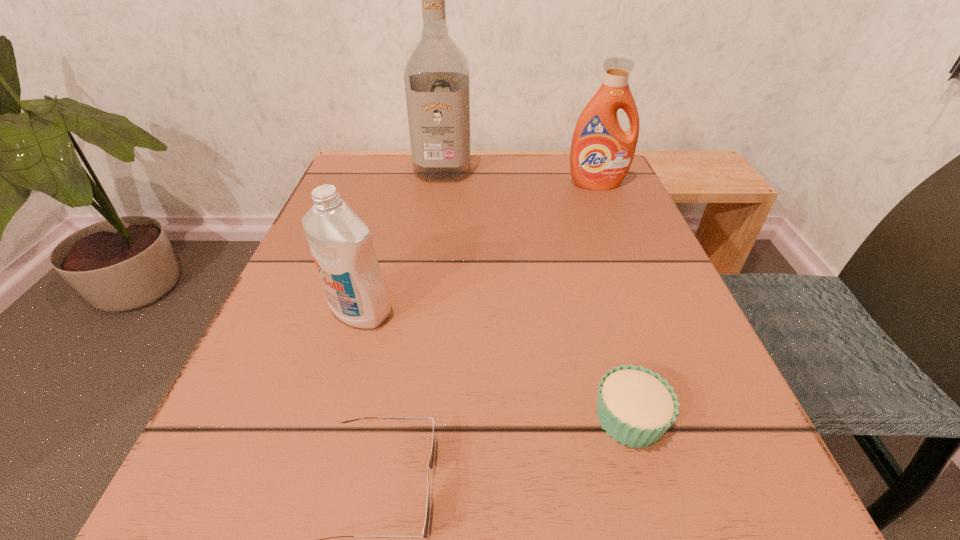
I want to click on unoccupied position between the right detergent and the left detergent, so click(478, 248).

Where is `free space between the second shortest object and the liquor`? The height and width of the screenshot is (540, 960). free space between the second shortest object and the liquor is located at coordinates (537, 294).

Locate an element on the screen. The height and width of the screenshot is (540, 960). blank region between the second shortest object and the tallest object is located at coordinates (537, 294).

This screenshot has width=960, height=540. What are the coordinates of `vacant space in between the second shortest object and the right detergent` in the screenshot? It's located at (613, 301).

Identify the location of unoccupied area between the cupcake and the farther detergent. (613, 301).

Identify the location of vacant space that's between the cupcake and the liquor. click(537, 294).

Locate an element on the screen. This screenshot has height=540, width=960. blank region between the liquor and the taller detergent is located at coordinates coord(519,177).

The height and width of the screenshot is (540, 960). In order to click on object that can be found as the closest to the shorter detergent in this screenshot , I will do `click(432, 457)`.

The width and height of the screenshot is (960, 540). I want to click on the fourth closest object to the nearer detergent, so click(601, 154).